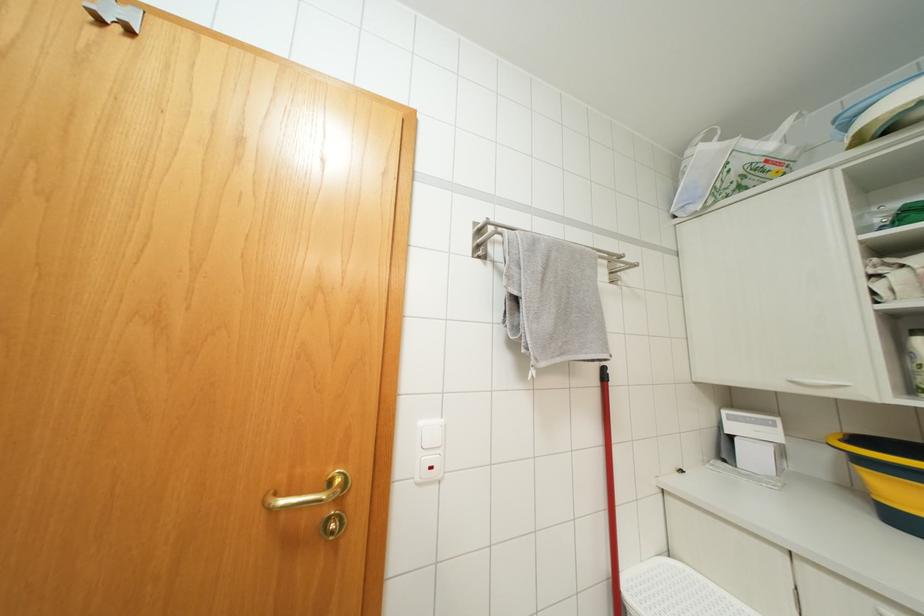
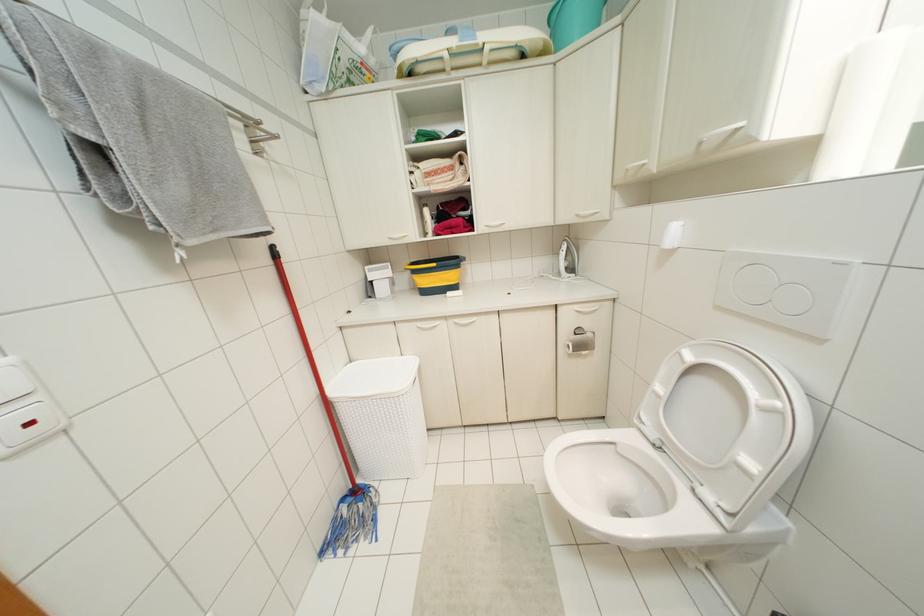
Locate, in the second image, the point that corresponds to [602,369] in the first image.

(273, 246)